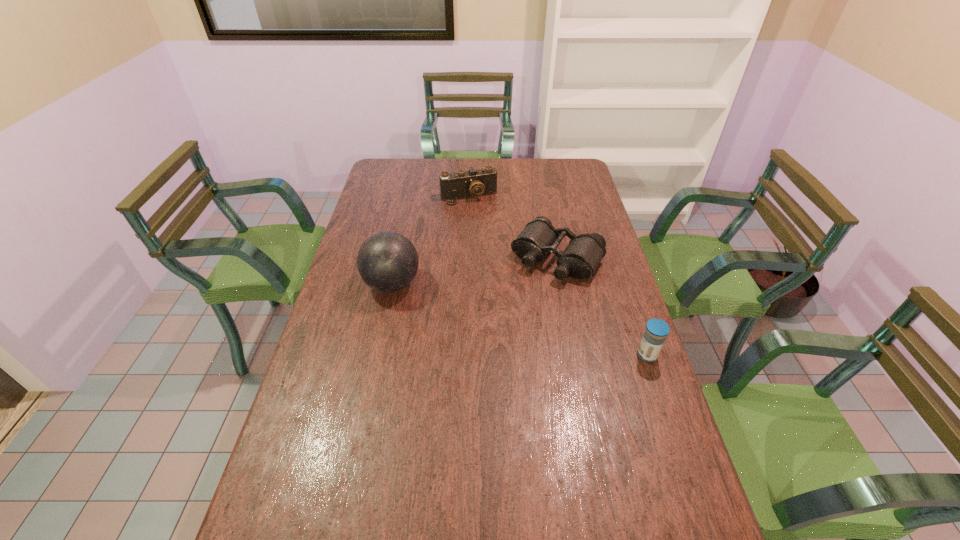
Identify the location of bowling ball. This screenshot has width=960, height=540. (387, 261).

Locate an element on the screen. the leftmost object is located at coordinates (387, 261).

Locate an element on the screen. The image size is (960, 540). the nearest object is located at coordinates (654, 336).

Identify the location of medicine. (654, 336).

I want to click on camera, so click(x=463, y=184).

Where is `the farthest object`? the farthest object is located at coordinates (463, 184).

Where is `the third object from left to right`? Image resolution: width=960 pixels, height=540 pixels. the third object from left to right is located at coordinates (579, 260).

Locate an element on the screen. Image resolution: width=960 pixels, height=540 pixels. the shortest object is located at coordinates (579, 260).

Where is `vacant space positioned 0.060m on the grip area of the bowling ball`? The width and height of the screenshot is (960, 540). vacant space positioned 0.060m on the grip area of the bowling ball is located at coordinates (345, 284).

Where is `vacant space situated on the grip area of the bowling ball`? vacant space situated on the grip area of the bowling ball is located at coordinates (342, 284).